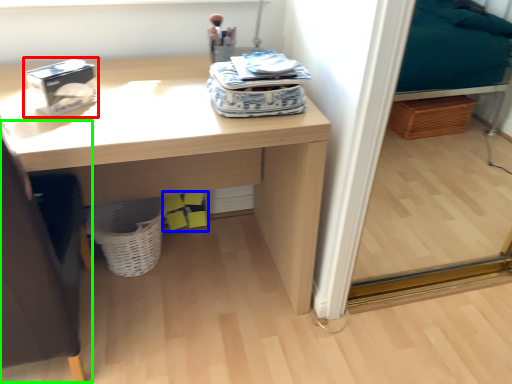
Question: Which is farther away from box (highlighted by a red box)? box (highlighted by a blue box) or swivel chair (highlighted by a green box)?

Choices:
 (A) box
 (B) swivel chair

Answer: (A)